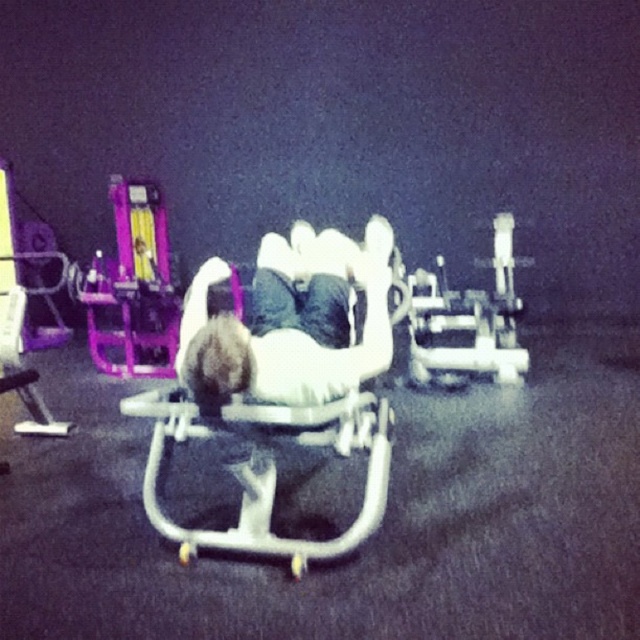
Is white matte bench at center positioned in front of white plastic sleigh at center?

That is True.

Looking at this image, between white matte bench at center and white plastic sleigh at center, which one is positioned lower?

white plastic sleigh at center is lower down.

The height and width of the screenshot is (640, 640). Describe the element at coordinates (292, 321) in the screenshot. I see `white matte bench at center` at that location.

At what (x,y) coordinates should I click in order to perform the action: click on white matte bench at center. Please return your answer as a coordinate pair (x, y). Looking at the image, I should click on (292, 321).